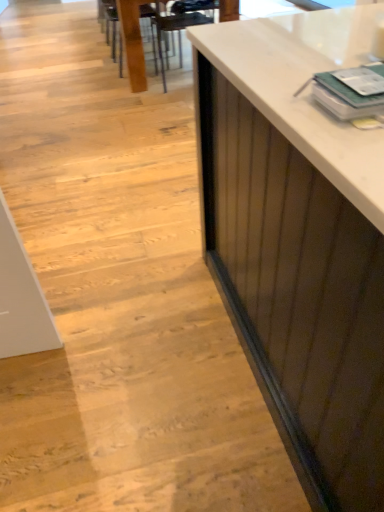
Question: Considering the positions of point (125, 8) and point (132, 82), is point (125, 8) closer or farther from the camera than point (132, 82)?

Choices:
 (A) closer
 (B) farther

Answer: (A)

Question: Considering the positions of wooden table at center and wooden chair at upper center in the image, is wooden table at center bigger or smaller than wooden chair at upper center?

Choices:
 (A) small
 (B) big

Answer: (B)

Question: Which of these objects is positioned farthest from the metallic dark brown armchair at upper center?

Choices:
 (A) wooden chair at upper center
 (B) wooden table at center

Answer: (A)

Question: Based on their relative distances, which object is nearer to the wooden chair at upper center?

Choices:
 (A) wooden table at center
 (B) metallic dark brown armchair at upper center

Answer: (A)